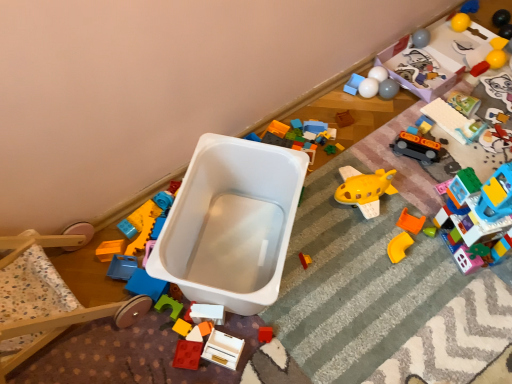
Find the location of `free location to the right of matte yellow toy airplane at center, arranged as the 5th toy when viewed from the left`. free location to the right of matte yellow toy airplane at center, arranged as the 5th toy when viewed from the left is located at coordinates (359, 265).